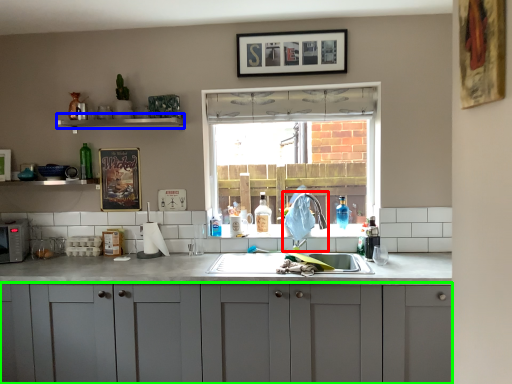
Question: Which object is the closest to the faucet (highlighted by a red box)? Choose among these: window sill (highlighted by a blue box) or cabinetry (highlighted by a green box).

Choices:
 (A) window sill
 (B) cabinetry

Answer: (B)